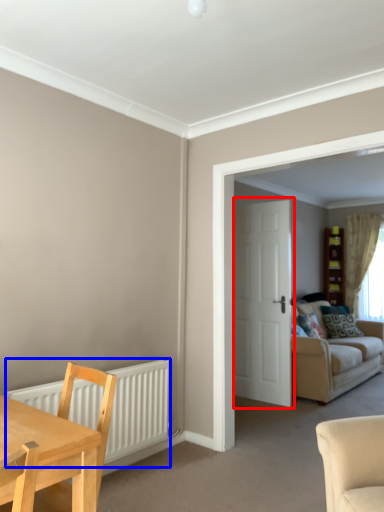
Question: Among these objects, which one is farthest to the camera, door (highlighted by a red box) or radiator (highlighted by a blue box)?

Choices:
 (A) door
 (B) radiator

Answer: (A)